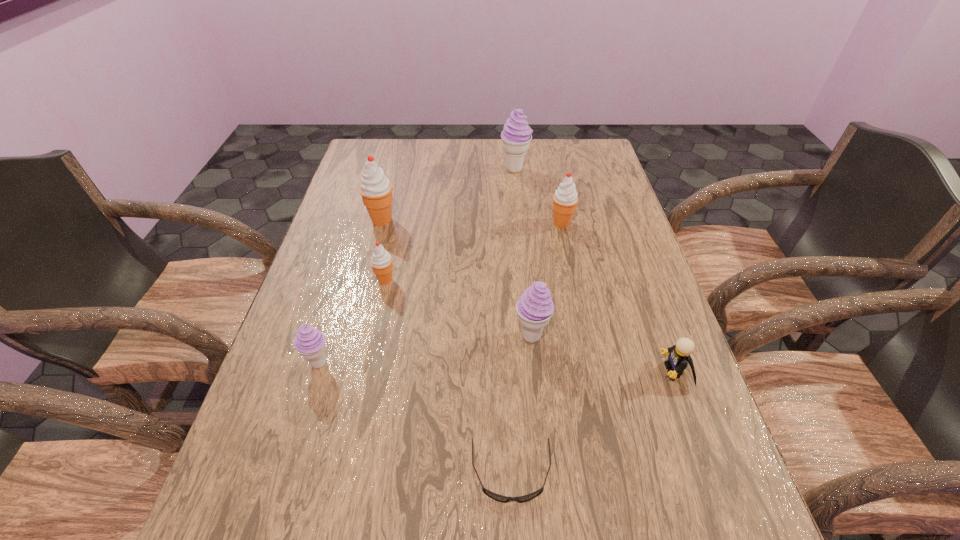
The height and width of the screenshot is (540, 960). In order to click on the farthest object in this screenshot , I will do `click(516, 135)`.

At what (x,y) coordinates should I click in order to perform the action: click on the farthest purple icecream. Please return your answer as a coordinate pair (x, y). This screenshot has width=960, height=540. Looking at the image, I should click on (516, 135).

Identify the location of the biggest red icecream. The image size is (960, 540). point(376,190).

Locate an element on the screen. The image size is (960, 540). the rightmost icecream is located at coordinates (565, 198).

Locate an element on the screen. Image resolution: width=960 pixels, height=540 pixels. the second biggest red icecream is located at coordinates (565, 198).

Image resolution: width=960 pixels, height=540 pixels. I want to click on the fourth nearest object, so click(x=535, y=307).

At what (x,y) coordinates should I click in order to perform the action: click on the second nearest purple icecream. Please return your answer as a coordinate pair (x, y). This screenshot has width=960, height=540. Looking at the image, I should click on (535, 307).

Find the location of a particular element. The image size is (960, 540). the smallest red icecream is located at coordinates (381, 261).

The image size is (960, 540). What are the coordinates of `the fourth farthest object` in the screenshot? It's located at (381, 261).

Image resolution: width=960 pixels, height=540 pixels. Find the location of `the nearest icecream`. the nearest icecream is located at coordinates (309, 342).